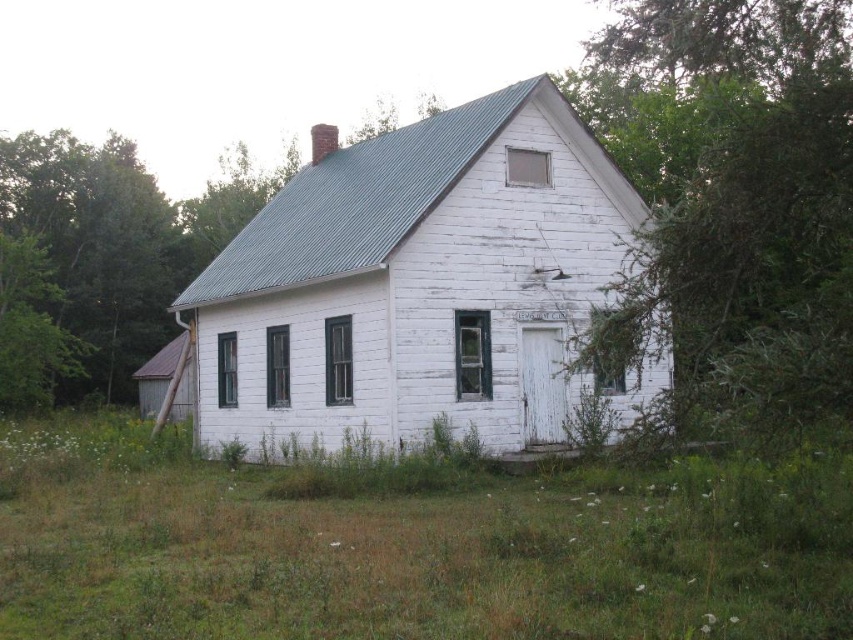
You are standing in front of the house and want to walk towards the green leafy tree at left. Which direction should you walk to avoid stepping on the green grass at lower center?

To avoid stepping on the green grass at lower center, you should walk around the left side of the green grass at lower center since its width is narrower than the green leafy tree at left, allowing enough space to bypass it without stepping on the grass.

Looking at this image, you are standing in front of the white wooden house and want to determine the spatial relationship between two points marked on the image. Which of the two points, point 1 at coordinates (503, 627) or point 2 at coordinates (808, 220), is closer to you?

Point 1 at coordinates (503, 627) is closer to the viewer than point 2 at coordinates (808, 220).